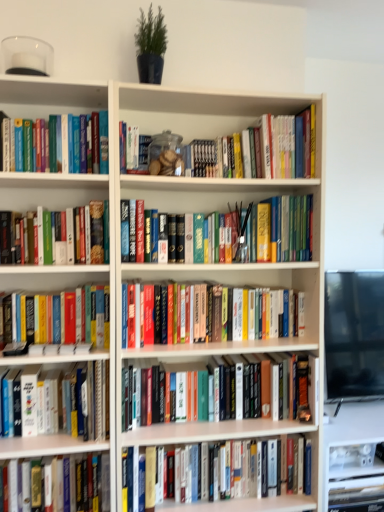
Question: Is white matte bookcase at center situated inside hardcover book at center, which is counted as the eighth book, starting from the bottom, or outside?

Choices:
 (A) inside
 (B) outside

Answer: (B)

Question: Is white matte bookcase at center in front of or behind hardcover book at center, which is counted as the eighth book, starting from the bottom, in the image?

Choices:
 (A) front
 (B) behind

Answer: (A)

Question: Which object is positioned farthest from the black glossy monitor at right?

Choices:
 (A) hardcover book at lower left, the first book in the bottom-to-top sequence
 (B) hardcover book at lower left, the fourth book positioned from the bottom
 (C) hardcover book at center, positioned as the third book in bottom-to-top order
 (D) hardcover book at center, the 2th book in the bottom-to-top sequence
 (E) white matte bookcase at center

Answer: (A)

Question: Estimate the real-world distances between objects in this image. Which object is farther from the hardcover book at center, the 2th book in the bottom-to-top sequence?

Choices:
 (A) black glossy monitor at right
 (B) hardcover book at center, which is the 7th book in bottom-to-top order
 (C) hardcover books at center, which is the fifth book in top-to-bottom order
 (D) green matte plant at upper center
 (E) hardcover book at lower left, marked as the 9th book in a top-to-bottom arrangement

Answer: (D)